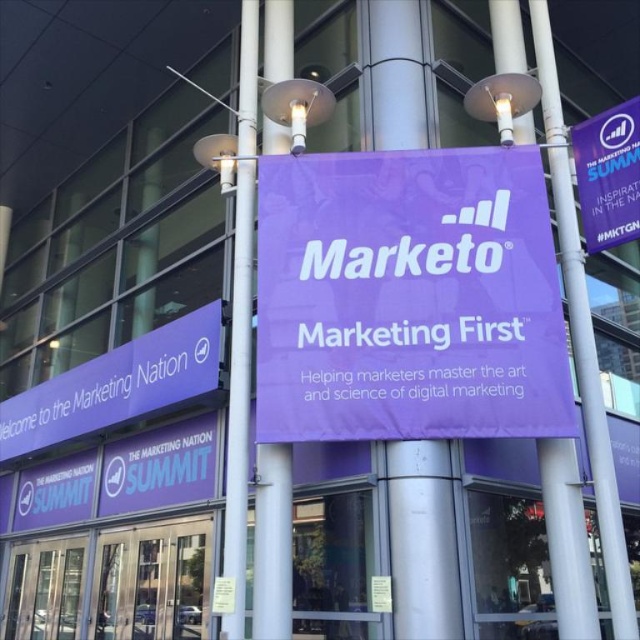
Is point (157, 352) less distant than point (116, 508)?

That is True.

Who is more distant from viewer, [125,385] or [205,428]?

The point [125,385] is behind.

Where is `matte purple banner at lower left`? This screenshot has height=640, width=640. matte purple banner at lower left is located at coordinates (116, 385).

This screenshot has width=640, height=640. Identify the location of purple fabric banner at center. (408, 298).

Which is above, purple fabric banner at center or purple fabric banner at upper right?

purple fabric banner at upper right

Is point (477, 198) behind point (636, 164)?

No, (477, 198) is closer to viewer.

Image resolution: width=640 pixels, height=640 pixels. Find the location of `purple fabric banner at center`. purple fabric banner at center is located at coordinates (408, 298).

In the scene shown: Which is more to the left, purple fabric banner at center or metallic silver pole at center?

From the viewer's perspective, metallic silver pole at center appears more on the left side.

Is the position of purple fabric banner at center more distant than that of metallic silver pole at center?

That is True.

Who is more distant from viewer, (388,381) or (232,371)?

The point (232,371) is behind.

Identify the location of purple fabric banner at center. (408, 298).